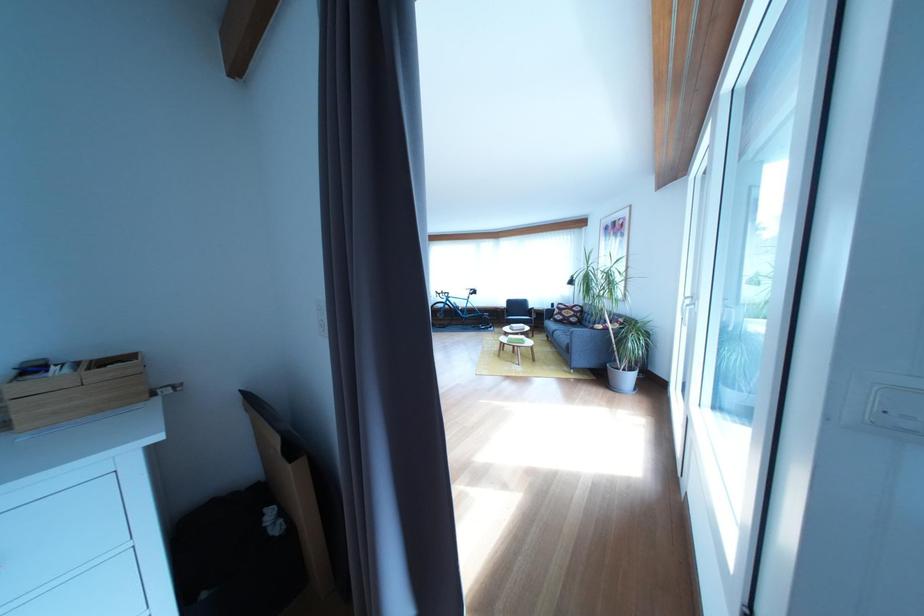
The location [566,313] corresponds to which object?

It corresponds to the patterned pillow in the image.